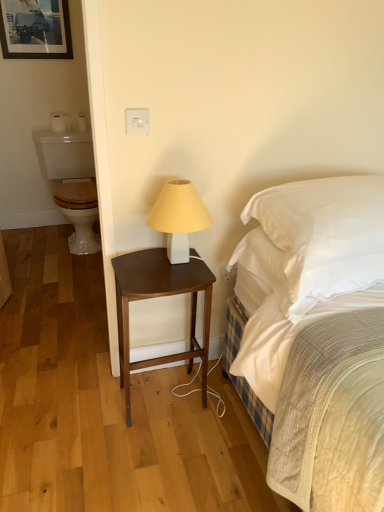
Identify the location of vacant space in front of white glossy toilet at left. (49, 276).